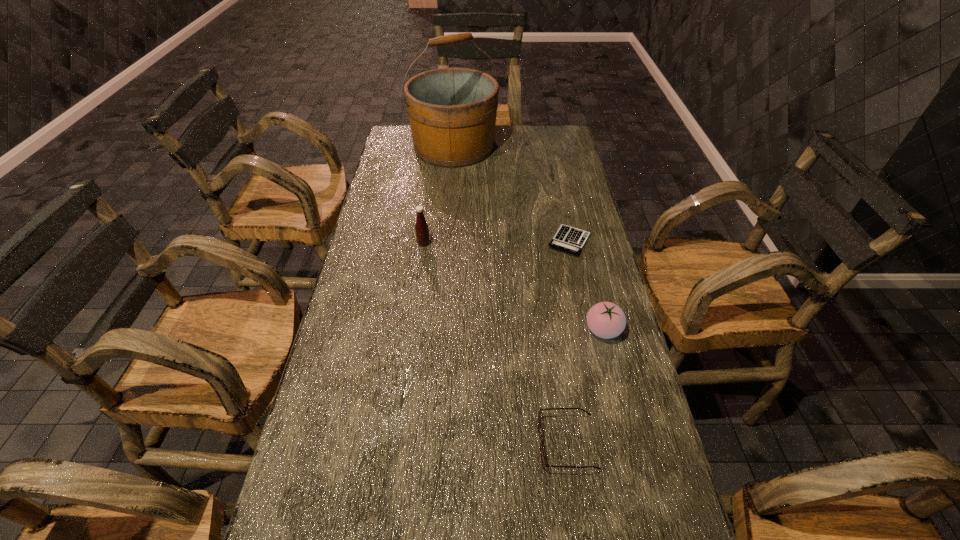
You are a GUI agent. You are given a task and a screenshot of the screen. Output one action in this format:
    pyautogui.click(x=<x>, y=<y>)
    Task: Click on the vacant space that is in between the third tallest object and the calculator
    This screenshot has width=960, height=540.
    Given the screenshot: What is the action you would take?
    pyautogui.click(x=587, y=286)

Identify the location of vacant area that lies between the tallest object and the shortest object. The height and width of the screenshot is (540, 960). (512, 194).

The image size is (960, 540). I want to click on free point between the calculator and the third tallest object, so click(587, 286).

Identify which object is the fourth closest to the fourth tallest object. Please provide its 2D coordinates. Your answer should be formatted as a tuple, i.e. [(x, y)], where the tuple contains the x and y coordinates of a point satisfying the conditions above.

[(452, 112)]

At what (x,y) coordinates should I click in order to perform the action: click on object that is the second closest one to the fourth shortest object. Please return your answer as a coordinate pair (x, y). Looking at the image, I should click on (452, 112).

Find the location of a particular element. The image size is (960, 540). vacant space that satisfies the following two spatial constraints: 1. on the front side of the shortest object; 2. on the right side of the bucket is located at coordinates (446, 241).

I want to click on free space that satisfies the following two spatial constraints: 1. on the front side of the tomato; 2. on the right side of the tallest object, so click(x=440, y=330).